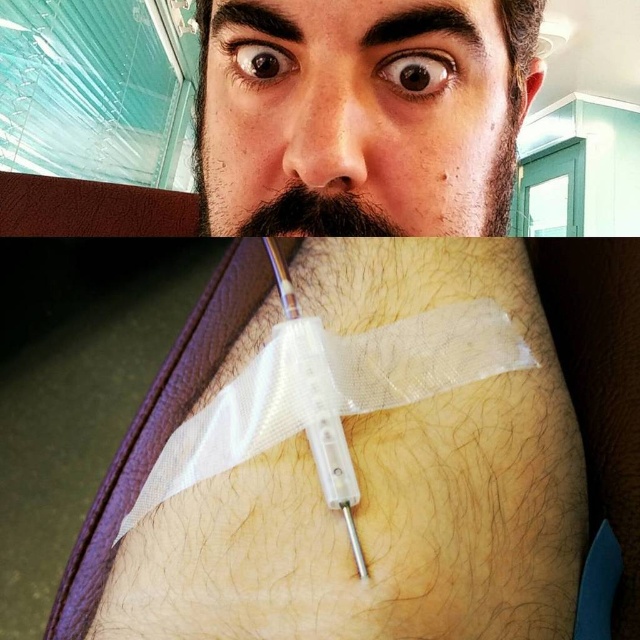
Looking at the image divided into two sections, you notice the matte black face at upper center and the brown fuzzy beard at upper center. Which of these two objects occupies a larger vertical space in the upper section?

The matte black face at upper center is much taller than the brown fuzzy beard at upper center, so it occupies a larger vertical space in the upper section.